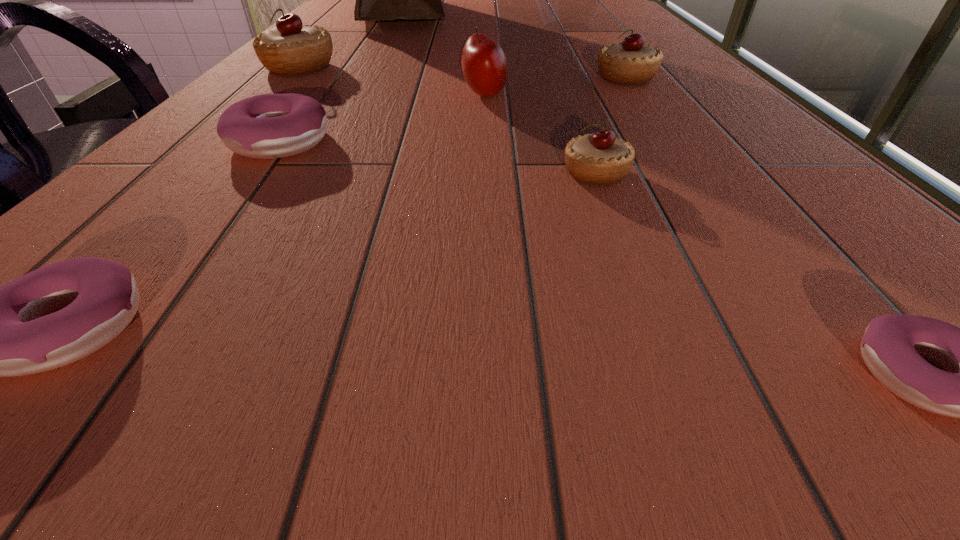
Locate which pastry is the fourth closest to the eighth tallest object. Please provide its 2D coordinates. Your answer should be formatted as a tuple, i.e. [(x, y)], where the tuple contains the x and y coordinates of a point satisfying the conditions above.

[(892, 345)]

Where is `the second closest beige pastry to the shortest pastry`? the second closest beige pastry to the shortest pastry is located at coordinates (630, 62).

Identify the location of beige pastry that can be found as the closest to the second shortest object. The height and width of the screenshot is (540, 960). (600, 158).

Select which pink pastry appears as the second closest to the biggest beige pastry. Please provide its 2D coordinates. Your answer should be formatted as a tuple, i.e. [(x, y)], where the tuple contains the x and y coordinates of a point satisfying the conditions above.

[(60, 313)]

Locate which pink pastry is the second closest to the lampshade. Please provide its 2D coordinates. Your answer should be formatted as a tuple, i.e. [(x, y)], where the tuple contains the x and y coordinates of a point satisfying the conditions above.

[(892, 345)]

Where is `vacant area that satisfies the following two spatial constraints: 1. on the front-facing side of the tallest object; 2. on the right side of the fourth pastry from left to right`? vacant area that satisfies the following two spatial constraints: 1. on the front-facing side of the tallest object; 2. on the right side of the fourth pastry from left to right is located at coordinates (310, 173).

Where is `free space that satisfies the following two spatial constraints: 1. on the front-facing side of the grocery bag; 2. on the front side of the third shortest object`? Image resolution: width=960 pixels, height=540 pixels. free space that satisfies the following two spatial constraints: 1. on the front-facing side of the grocery bag; 2. on the front side of the third shortest object is located at coordinates (327, 142).

I want to click on vacant region that satisfies the following two spatial constraints: 1. on the front-facing side of the tallest object; 2. on the back side of the second beige pastry from right to left, so click(x=310, y=173).

The image size is (960, 540). I want to click on free location that satisfies the following two spatial constraints: 1. on the front side of the leftmost beige pastry; 2. on the left side of the fifth object from right to left, so click(x=274, y=95).